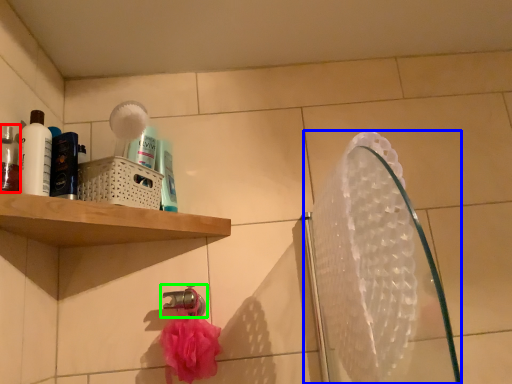
Question: Considering the real-world distances, which object is farthest from mouthwash (highlighted by a red box)? mirror (highlighted by a blue box) or tap (highlighted by a green box)?

Choices:
 (A) mirror
 (B) tap

Answer: (A)